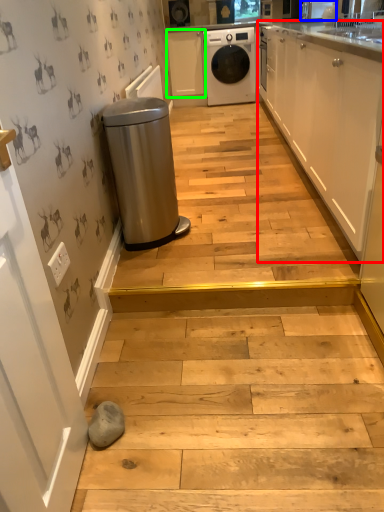
Question: Which is farther away from cabinetry (highlighted by a red box)? appliance (highlighted by a blue box) or cabinetry (highlighted by a green box)?

Choices:
 (A) appliance
 (B) cabinetry

Answer: (B)